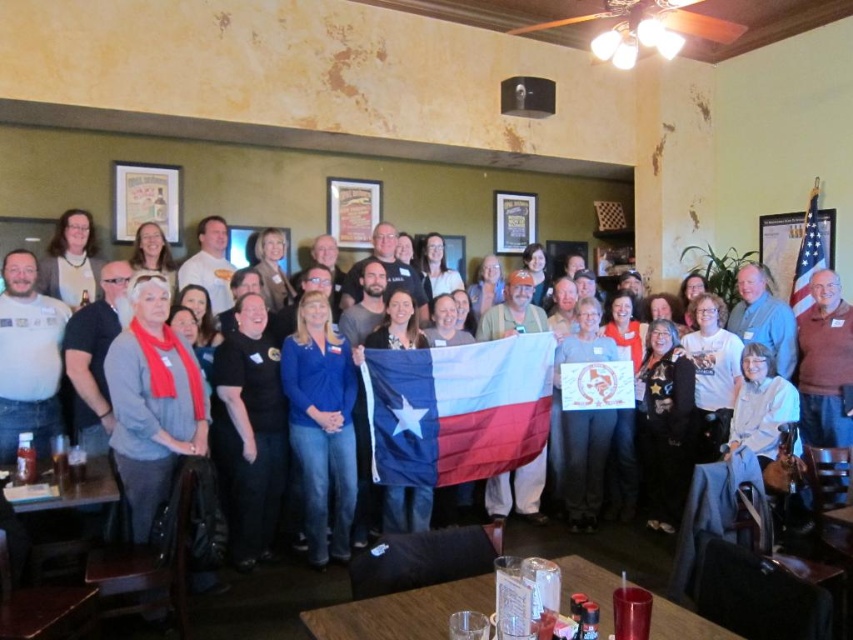
Which is in front, point (404, 449) or point (804, 301)?

Positioned in front is point (404, 449).

Does polyester texas flag at center lie behind american flag at upper right?

No.

Is point (466, 401) positioned after point (809, 259)?

No, it is not.

Identify the location of polyester texas flag at center. (457, 410).